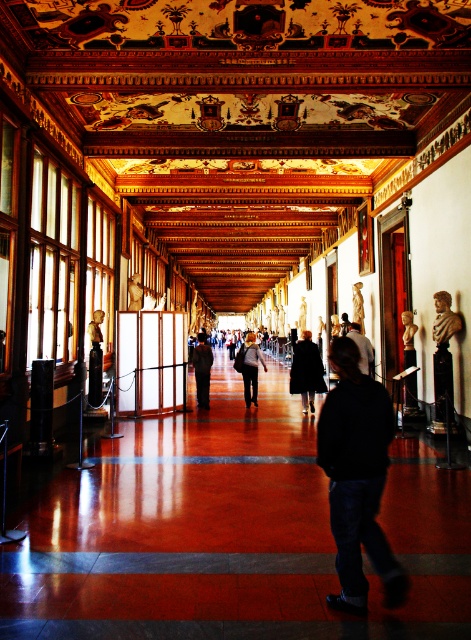
Find the location of a particular element. dark gray fabric coat at center is located at coordinates (249, 365).

Which is in front, point (253, 332) or point (452, 320)?

Positioned in front is point (452, 320).

The width and height of the screenshot is (471, 640). What do you see at coordinates (249, 365) in the screenshot?
I see `dark gray fabric coat at center` at bounding box center [249, 365].

Find the location of a particular element. The image size is (471, 640). dark gray fabric coat at center is located at coordinates (249, 365).

Who is more distant from viewer, (309, 403) or (265, 368)?

Point (265, 368)

Is point (316, 387) in front of point (259, 349)?

That is True.

Is point (310, 355) behind point (240, 358)?

No, (310, 355) is closer to viewer.

Where is `black coat at center`? black coat at center is located at coordinates (307, 371).

Is black coat at center positioned before dark brown leather jacket at center?

Yes, black coat at center is in front of dark brown leather jacket at center.

Is point (316, 378) positioned after point (202, 337)?

No.

Find the location of a particular element. This screenshot has height=640, width=471. black coat at center is located at coordinates point(307,371).